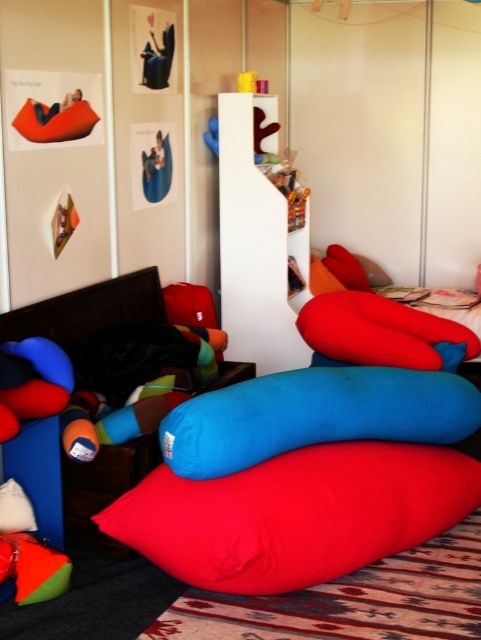
You are organizing a childrens party and need to arrange seating for guests. You have a matte red beanbag at lower center and a blue soft cushion at center. Which seating option is bigger and more suitable for a child to sit comfortably?

The matte red beanbag at lower center is larger in size than the blue soft cushion at center, making it more suitable for a child to sit comfortably.

You are standing at the entrance of the room and want to place a new decorative item exactly at the center of the room. The blue soft cushion at center is already placed at coordinates point 0.650, 0.655. Can you confirm if the cushion is positioned at the exact center of the room?

The blue soft cushion at center is located at point (x=315, y=416), which indicates it is placed at the exact center of the room.

You are standing in the living room and want to determine which of the two points is closer to you. The points are located at coordinates point (255, 403) and point (416, 346). Which point is closer?

Point (255, 403) is closer to the viewer than point (416, 346).